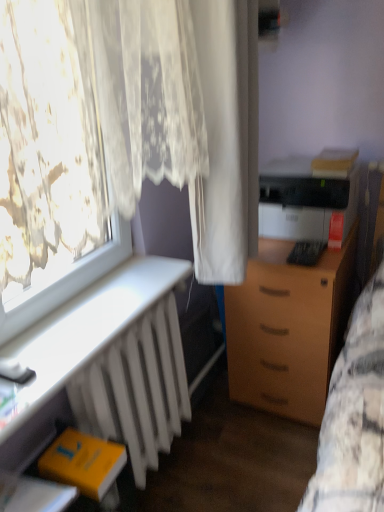
In order to click on vacant region below white sheer curtain at center (from a real-world perspective) in this screenshot , I will do `click(244, 438)`.